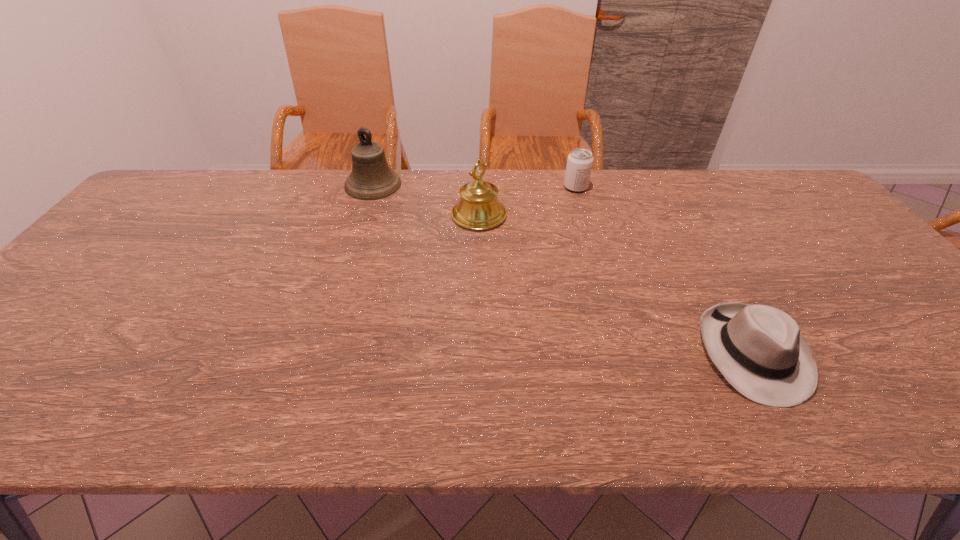
Find the location of a particular element. This screenshot has width=960, height=540. empty space between the leftmost object and the right bell is located at coordinates pyautogui.click(x=426, y=200).

The image size is (960, 540). Find the location of `free space between the second shortest object and the shortest object`. free space between the second shortest object and the shortest object is located at coordinates (664, 270).

Where is `vacant region between the rightmost object and the third object from left to right`? The height and width of the screenshot is (540, 960). vacant region between the rightmost object and the third object from left to right is located at coordinates (664, 270).

At what (x,y) coordinates should I click in order to perform the action: click on empty location between the second object from left to right and the shortest object. Please return your answer as a coordinate pair (x, y). Looking at the image, I should click on (616, 284).

Locate an element on the screen. vacant space in between the right bell and the second shortest object is located at coordinates (527, 201).

Select which object is the third closest to the right bell. Please provide its 2D coordinates. Your answer should be formatted as a tuple, i.e. [(x, y)], where the tuple contains the x and y coordinates of a point satisfying the conditions above.

[(759, 349)]

Locate an element on the screen. object that stands as the second closest to the right bell is located at coordinates (579, 163).

You are a GUI agent. You are given a task and a screenshot of the screen. Output one action in this format:
    pyautogui.click(x=<x>, y=<y>)
    Task: Click on the free space that satisfies the following two spatial constraints: 1. on the front side of the left bell; 2. on the left side of the second shortest object
    The width and height of the screenshot is (960, 540).
    Given the screenshot: What is the action you would take?
    pyautogui.click(x=372, y=187)